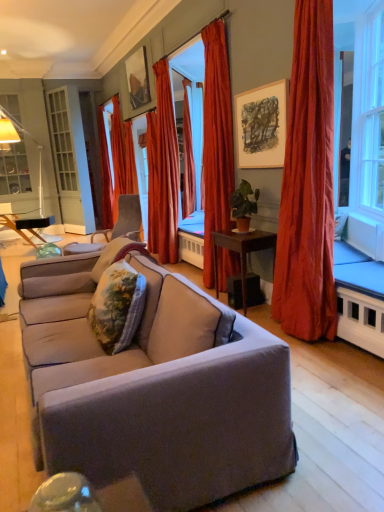
Question: Should I look upward or downward to see matte wooden picture frame at upper center, arranged as the 1th picture frame when ordered from the bottom?

Choices:
 (A) up
 (B) down

Answer: (A)

Question: Considering the relative positions of floral fabric pillow at center, which is the 1th pillow in back-to-front order, and green matte plant at center in the image provided, is floral fabric pillow at center, which is the 1th pillow in back-to-front order, behind green matte plant at center?

Choices:
 (A) no
 (B) yes

Answer: (A)

Question: Does floral fabric pillow at center, which is the 1th pillow in back-to-front order, have a greater width compared to green matte plant at center?

Choices:
 (A) no
 (B) yes

Answer: (B)

Question: From a real-world perspective, is floral fabric pillow at center, which is the 1th pillow in back-to-front order, located beneath green matte plant at center?

Choices:
 (A) no
 (B) yes

Answer: (B)

Question: Does floral fabric pillow at center, which is the 1th pillow in back-to-front order, have a lesser width compared to green matte plant at center?

Choices:
 (A) no
 (B) yes

Answer: (A)

Question: Is the position of floral fabric pillow at center, which is the 1th pillow in back-to-front order, less distant than that of green matte plant at center?

Choices:
 (A) no
 (B) yes

Answer: (B)

Question: Would you consider floral fabric pillow at center, the 2th pillow when ordered from front to back, to be distant from green matte plant at center?

Choices:
 (A) yes
 (B) no

Answer: (A)

Question: Is white glass screen door at left aimed at green matte plant at center?

Choices:
 (A) no
 (B) yes

Answer: (A)

Question: From the image's perspective, does white glass screen door at left appear lower than green matte plant at center?

Choices:
 (A) no
 (B) yes

Answer: (A)

Question: Does white glass screen door at left have a larger size compared to green matte plant at center?

Choices:
 (A) no
 (B) yes

Answer: (B)

Question: Is white glass screen door at left surrounding green matte plant at center?

Choices:
 (A) no
 (B) yes

Answer: (A)

Question: Does white glass screen door at left appear on the right side of green matte plant at center?

Choices:
 (A) no
 (B) yes

Answer: (A)

Question: Can you confirm if white glass screen door at left is shorter than green matte plant at center?

Choices:
 (A) no
 (B) yes

Answer: (A)

Question: Is velvet gray chair at center in contact with satin red curtain at center, which ranks as the 4th curtain in back-to-front order?

Choices:
 (A) no
 (B) yes

Answer: (A)